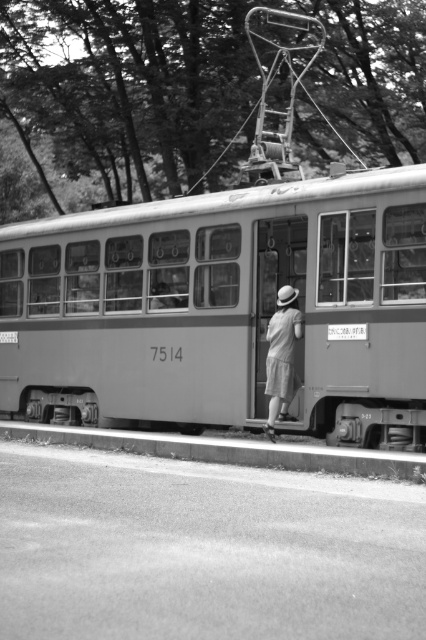
Question: Is metallic gray tram at center bigger than smooth concrete curb at lower center?

Choices:
 (A) yes
 (B) no

Answer: (A)

Question: Can you confirm if metallic gray tram at center is smaller than light gray cotton shorts at center?

Choices:
 (A) yes
 (B) no

Answer: (B)

Question: Can you confirm if metallic gray tram at center is positioned to the left of smooth concrete curb at lower center?

Choices:
 (A) yes
 (B) no

Answer: (A)

Question: Which point is farther from the camera taking this photo?

Choices:
 (A) (293, 301)
 (B) (279, 456)
 (C) (17, 291)

Answer: (C)

Question: Which of the following is the farthest from the observer?

Choices:
 (A) smooth concrete curb at lower center
 (B) metallic gray tram at center

Answer: (B)

Question: Which of the following is the closest to the observer?

Choices:
 (A) smooth concrete curb at lower center
 (B) metallic gray tram at center

Answer: (A)